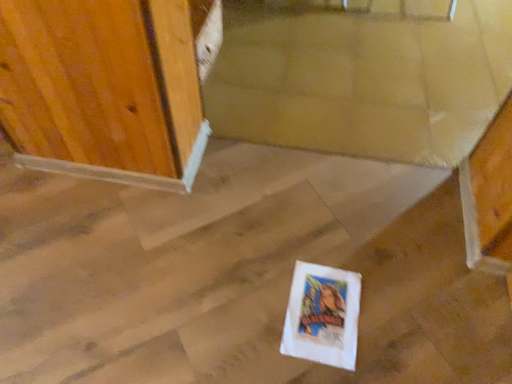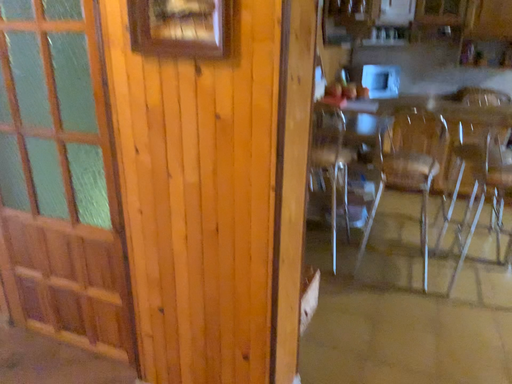
Question: How did the camera likely rotate when shooting the video?

Choices:
 (A) rotated upward
 (B) rotated downward

Answer: (A)